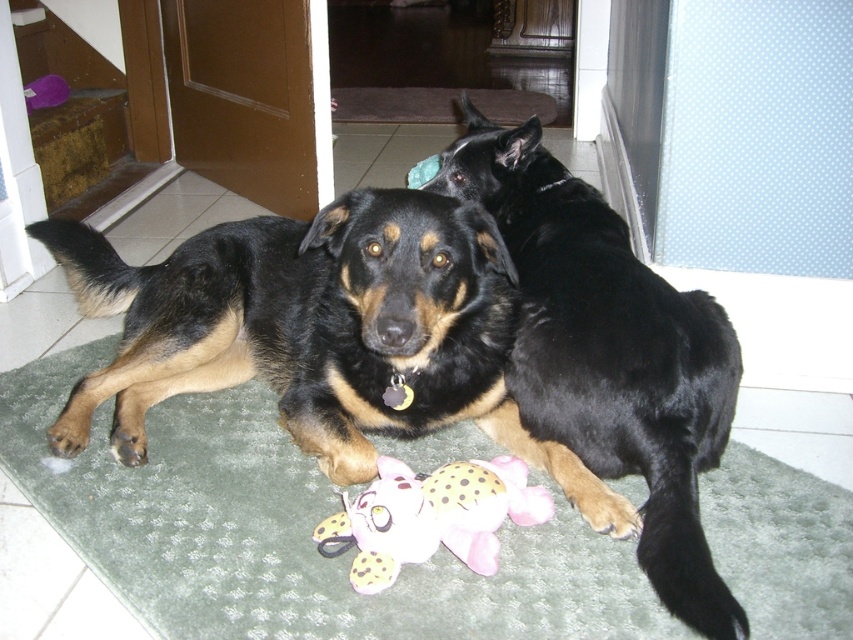
You are standing at the edge of the room and want to place a small plant pot exactly at point (288, 532). According to the scene, where should you place it?

Place the small plant pot at point (288, 532) on the green carpet at center.

You are a dog owner who wants to place a new dog bed for your pets. The green carpet at center and the pink plush toy at center are already present. Where should you place the new dog bed so it doesn not interfere with the existing items?

The green carpet at center is positioned under the pink plush toy at center, so placing the new dog bed away from the center area would prevent interference with both items.

You are taking a photo of two dogs on a mat. There are two points marked in the image. Which point, point [842,572] or point [357,556], is closer to the camera?

Point [842,572] is closer to the camera than point [357,556].